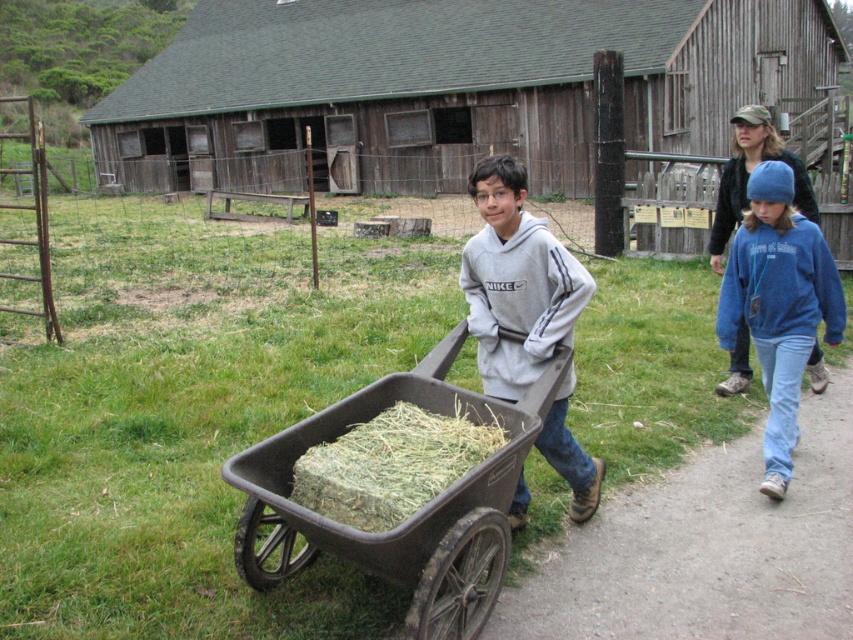
Question: Considering the real-world distances, which object is farthest from the green grass at center?

Choices:
 (A) blue fleece sweatshirt at right
 (B) green straw at center
 (C) dark gray plastic cart at center

Answer: (A)

Question: Is blue fleece sweatshirt at right positioned in front of green straw at center?

Choices:
 (A) no
 (B) yes

Answer: (A)

Question: Is dark gray plastic cart at center further to the viewer compared to blue fleece sweatshirt at right?

Choices:
 (A) yes
 (B) no

Answer: (B)

Question: Based on their relative distances, which object is nearer to the green grass at center?

Choices:
 (A) blue fleece sweatshirt at right
 (B) green straw at center
 (C) dark gray plastic cart at center
 (D) gray fleece hoodie at center

Answer: (B)

Question: Can you confirm if dark gray plastic cart at center is positioned below green straw at center?

Choices:
 (A) no
 (B) yes

Answer: (B)

Question: Which of the following is the farthest from the observer?

Choices:
 (A) (514, 243)
 (B) (305, 422)

Answer: (A)